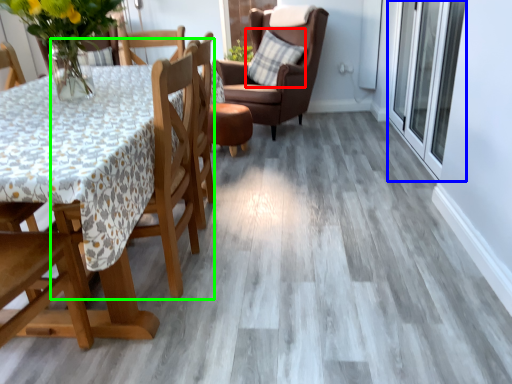
Question: Which is farther away from pillow (highlighted by a red box)? screen door (highlighted by a blue box) or chair (highlighted by a green box)?

Choices:
 (A) screen door
 (B) chair

Answer: (B)